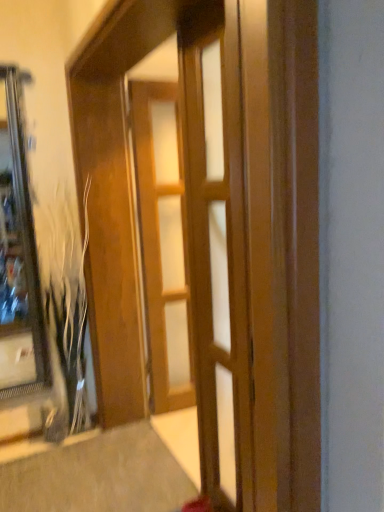
Question: From the image's perspective, does wooden barn door at center appear lower than wooden door at center, which appears as the 2th door when viewed from the back?

Choices:
 (A) yes
 (B) no

Answer: (A)

Question: Could you tell me if wooden barn door at center is turned towards wooden door at center, which appears as the 1th door when viewed from the front?

Choices:
 (A) no
 (B) yes

Answer: (B)

Question: From the image's perspective, is wooden barn door at center on top of wooden door at center, which appears as the 1th door when viewed from the front?

Choices:
 (A) no
 (B) yes

Answer: (A)

Question: Is the depth of wooden barn door at center less than that of wooden door at center, which appears as the 1th door when viewed from the front?

Choices:
 (A) no
 (B) yes

Answer: (B)

Question: Is wooden barn door at center at the right side of wooden door at center, which appears as the 2th door when viewed from the back?

Choices:
 (A) no
 (B) yes

Answer: (A)

Question: Does wooden barn door at center have a greater width compared to wooden door at center, which appears as the 2th door when viewed from the back?

Choices:
 (A) yes
 (B) no

Answer: (A)

Question: Does wooden door at center, which ranks as the 1th door in back-to-front order, come in front of wooden door at center, which appears as the 2th door when viewed from the back?

Choices:
 (A) no
 (B) yes

Answer: (A)

Question: From a real-world perspective, is wooden door at center, which ranks as the 1th door in back-to-front order, under wooden door at center, which appears as the 1th door when viewed from the front?

Choices:
 (A) no
 (B) yes

Answer: (B)

Question: Does wooden door at center, which ranks as the 1th door in back-to-front order, lie behind wooden door at center, which appears as the 2th door when viewed from the back?

Choices:
 (A) yes
 (B) no

Answer: (A)

Question: From a real-world perspective, is wooden door at center, which ranks as the 1th door in back-to-front order, on top of wooden door at center, which appears as the 1th door when viewed from the front?

Choices:
 (A) yes
 (B) no

Answer: (B)

Question: Is wooden door at center, which is the 2th door from front to back, to the left of wooden door at center, which appears as the 1th door when viewed from the front, from the viewer's perspective?

Choices:
 (A) no
 (B) yes

Answer: (B)

Question: Is wooden door at center, which ranks as the 1th door in back-to-front order, facing away from wooden door at center, which appears as the 1th door when viewed from the front?

Choices:
 (A) yes
 (B) no

Answer: (B)

Question: Does wooden barn door at center have a lesser height compared to wooden door at center, which ranks as the 1th door in back-to-front order?

Choices:
 (A) yes
 (B) no

Answer: (B)